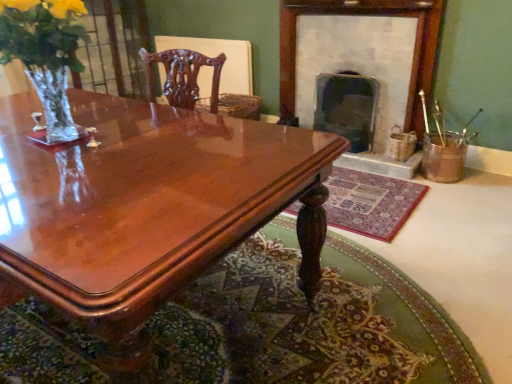
Locate an element on the screen. This screenshot has width=512, height=384. free spot to the right of clear glass vase at left is located at coordinates [142, 140].